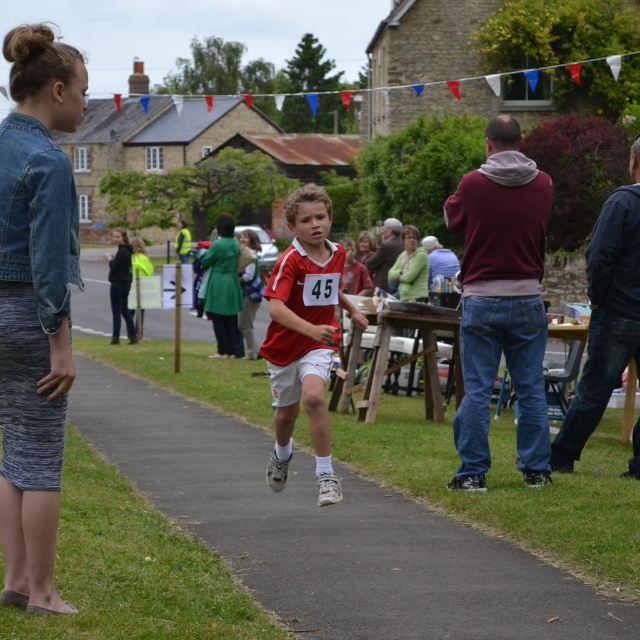
Is green fabric coat at center shorter than green fabric coat at left?

Yes, green fabric coat at center is shorter than green fabric coat at left.

Based on the photo, can you confirm if green fabric coat at center is positioned below green fabric coat at left?

Yes.

What do you see at coordinates (221, 289) in the screenshot? Image resolution: width=640 pixels, height=640 pixels. I see `green fabric coat at center` at bounding box center [221, 289].

Where is `green fabric coat at center`? green fabric coat at center is located at coordinates (221, 289).

Which is below, maroon hoodie at center or denim jacket at lower right?

denim jacket at lower right

Between point (548, 211) and point (630, 148), which one is positioned behind?

Point (630, 148)

Is point (538, 280) farther from viewer compared to point (593, 348)?

No, (538, 280) is in front of (593, 348).

Locate an element on the screen. maroon hoodie at center is located at coordinates (500, 301).

Does denim jacket at left appear on the right side of matte red jersey at center?

In fact, denim jacket at left is to the left of matte red jersey at center.

The width and height of the screenshot is (640, 640). What do you see at coordinates (35, 305) in the screenshot?
I see `denim jacket at left` at bounding box center [35, 305].

Describe the element at coordinates (35, 305) in the screenshot. I see `denim jacket at left` at that location.

I want to click on denim jacket at left, so click(35, 305).